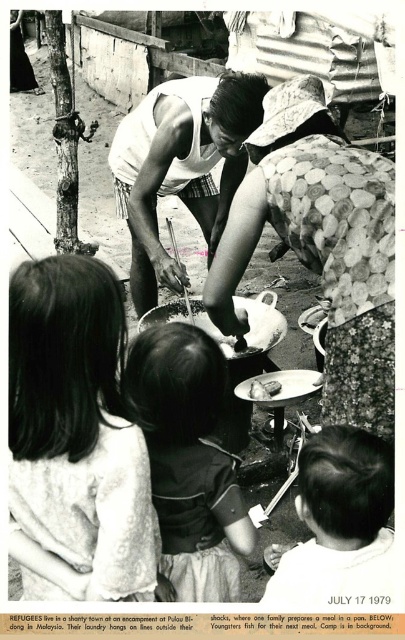
Can you confirm if floral fabric dress at center is positioned to the right of dark hair at lower right?

In fact, floral fabric dress at center is to the left of dark hair at lower right.

Based on the photo, which of these two, floral fabric dress at center or dark hair at lower right, stands shorter?

Standing shorter between the two is dark hair at lower right.

Between point (370, 348) and point (326, 544), which one is positioned in front?

Point (326, 544)

Identify the location of floral fabric dress at center. (321, 244).

Between matte white shirt at center and smooth white plate at center, which one is positioned lower?

smooth white plate at center is lower down.

Does point (138, 157) lie behind point (268, 392)?

Yes, it is.

Between point (162, 177) and point (277, 385), which one is positioned in front?

Point (277, 385) is in front.

Find the location of `matte white shirt at center`. matte white shirt at center is located at coordinates (181, 166).

What do you see at coordinates (321, 244) in the screenshot? The image size is (405, 640). I see `floral fabric dress at center` at bounding box center [321, 244].

Is floral fabric dress at center to the left of matte white shirt at center from the viewer's perspective?

No, floral fabric dress at center is not to the left of matte white shirt at center.

Where is `floral fabric dress at center`? floral fabric dress at center is located at coordinates (321, 244).